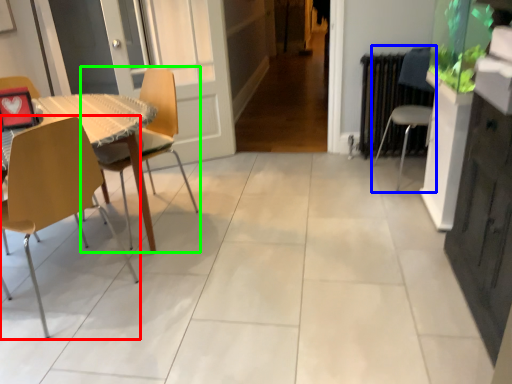
Question: Estimate the real-world distances between objects in this image. Which object is farther from chair (highlighted by a red box), chair (highlighted by a blue box) or chair (highlighted by a green box)?

Choices:
 (A) chair
 (B) chair

Answer: (A)